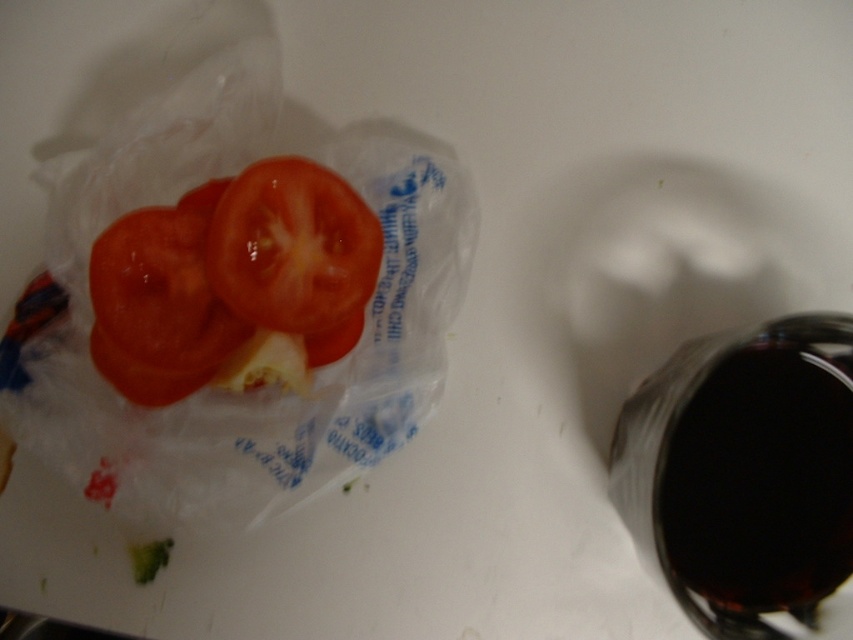
Question: Does shiny red tomato at left appear under shiny red tomato at center?

Choices:
 (A) no
 (B) yes

Answer: (B)

Question: Can you confirm if shiny red tomato at left is thinner than shiny red tomato at center?

Choices:
 (A) no
 (B) yes

Answer: (A)

Question: Which object appears closest to the camera in this image?

Choices:
 (A) shiny red tomato at center
 (B) shiny red tomato at left

Answer: (B)

Question: Can you confirm if shiny red tomato at left is positioned below shiny red tomato at center?

Choices:
 (A) no
 (B) yes

Answer: (B)

Question: Among these points, which one is farthest from the camera?

Choices:
 (A) (242, 179)
 (B) (225, 314)

Answer: (B)